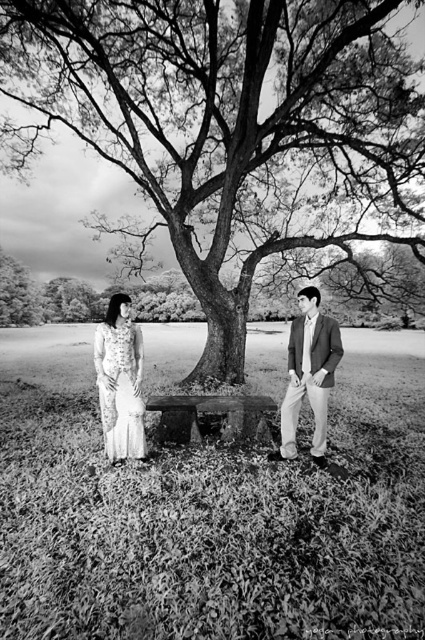
You are a GUI agent. You are given a task and a screenshot of the screen. Output one action in this format:
    pyautogui.click(x=<x>, y=<y>)
    Task: Click on the white lace dress at left
    Image resolution: width=425 pixels, height=640 pixels.
    Given the screenshot: What is the action you would take?
    pyautogui.click(x=119, y=381)

Does white lace dress at left lie behind smooth beige suit at center?

Yes, it is.

Find the location of a particular element. white lace dress at left is located at coordinates (119, 381).

In order to click on white lace dress at left in this screenshot , I will do `click(119, 381)`.

Does smooth beige suit at center appear on the left side of wooden park bench at center?

No, smooth beige suit at center is not to the left of wooden park bench at center.

What do you see at coordinates (308, 374) in the screenshot? Image resolution: width=425 pixels, height=640 pixels. I see `smooth beige suit at center` at bounding box center [308, 374].

In order to click on smooth beige suit at center in this screenshot , I will do (x=308, y=374).

Does matte wood bench at center have a greater height compared to smooth beige suit at center?

In fact, matte wood bench at center may be shorter than smooth beige suit at center.

Can you confirm if matte wood bench at center is shorter than smooth beige suit at center?

Correct, matte wood bench at center is not as tall as smooth beige suit at center.

At what (x,y) coordinates should I click in order to perform the action: click on matte wood bench at center. Please return your answer as a coordinate pair (x, y). This screenshot has width=425, height=640. Looking at the image, I should click on (308, 376).